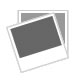
This screenshot has height=80, width=80. Find the location of `corners of photo frames`. corners of photo frames is located at coordinates click(x=6, y=27), click(x=21, y=72), click(x=67, y=57), click(x=68, y=11), click(x=16, y=9).